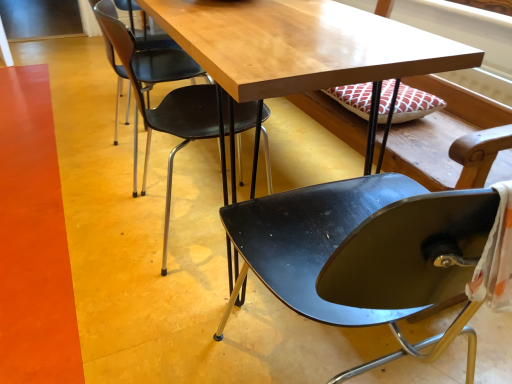
Question: Is black plastic chair at upper center, which is the 2th chair from right to left, spatially inside wooden table at center, or outside of it?

Choices:
 (A) inside
 (B) outside

Answer: (A)

Question: Is black plastic chair at upper center, which is the 2th chair from right to left, wider or thinner than wooden table at center?

Choices:
 (A) wide
 (B) thin

Answer: (B)

Question: Which of these objects is positioned farthest from the glossy black chair at center, arranged as the 1th chair when viewed from the right?

Choices:
 (A) black plastic chair at upper center, acting as the 1th chair starting from the left
 (B) wooden table at center

Answer: (A)

Question: Considering the real-world distances, which object is farthest from the glossy black chair at center, which is counted as the 2th chair, starting from the left?

Choices:
 (A) black plastic chair at upper center, which is the 2th chair from right to left
 (B) wooden table at center

Answer: (A)